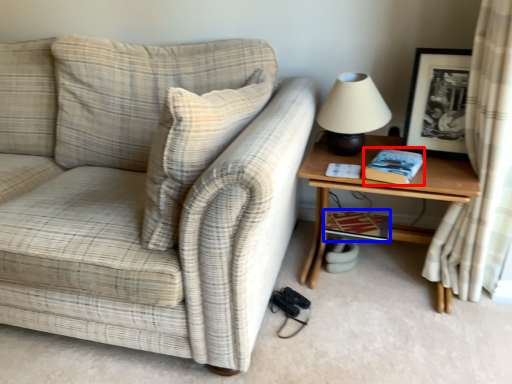
Question: Which object is further to the camera taking this photo, book (highlighted by a red box) or book (highlighted by a blue box)?

Choices:
 (A) book
 (B) book

Answer: (B)